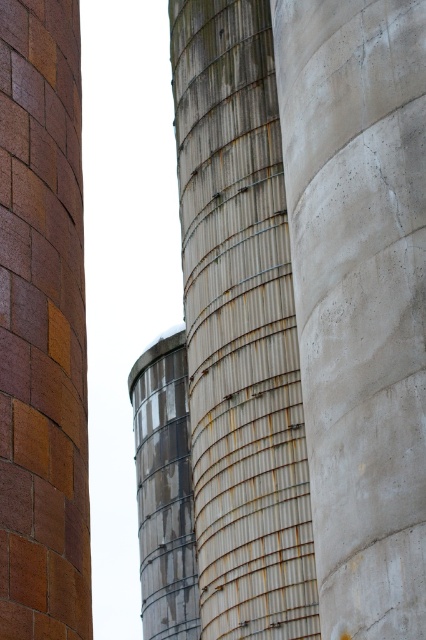
Which of these two, rusty metal silo at center or multicolored brick chimney at left, stands shorter?

multicolored brick chimney at left

Between rusty metal silo at center and multicolored brick chimney at left, which one has more height?

rusty metal silo at center

Which is behind, point (219, 60) or point (25, 540)?

Positioned behind is point (219, 60).

Locate an element on the screen. rusty metal silo at center is located at coordinates (239, 328).

Which is in front, point (359, 376) or point (276, 588)?

Point (359, 376)

Does smooth concrete pillar at center appear on the right side of rusty metal silo at center?

Correct, you'll find smooth concrete pillar at center to the right of rusty metal silo at center.

The height and width of the screenshot is (640, 426). What do you see at coordinates (359, 298) in the screenshot? I see `smooth concrete pillar at center` at bounding box center [359, 298].

The width and height of the screenshot is (426, 640). Identify the location of smooth concrete pillar at center. (359, 298).

Does point (327, 214) lie in front of point (39, 97)?

Yes, point (327, 214) is closer to viewer.

Is smooth concrete pillar at center thinner than multicolored brick chimney at left?

No.

Between point (350, 3) and point (20, 596), which one is positioned behind?

The point (350, 3) is behind.

At what (x,y) coordinates should I click in order to perform the action: click on smooth concrete pillar at center. Please return your answer as a coordinate pair (x, y). Looking at the image, I should click on pyautogui.click(x=359, y=298).